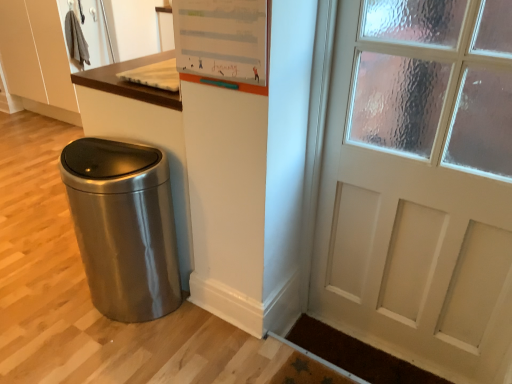
This screenshot has height=384, width=512. I want to click on vacant area on top of brown textured mat at lower right (from a real-world perspective), so click(x=357, y=357).